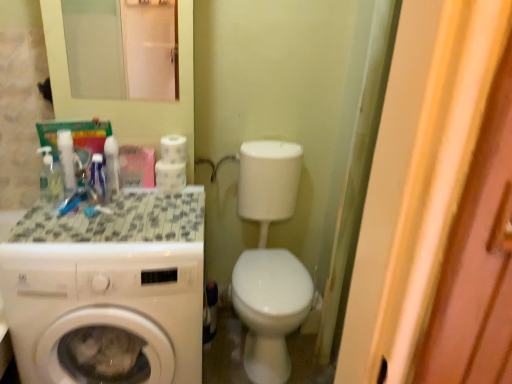
Question: Considering the relative sizes of white glossy washing machine at left and white glossy mouthwash at upper left, which is the third mouthwash from left to right, in the image provided, is white glossy washing machine at left taller than white glossy mouthwash at upper left, which is the third mouthwash from left to right,?

Choices:
 (A) no
 (B) yes

Answer: (B)

Question: Is white glossy washing machine at left directly adjacent to white glossy mouthwash at upper left, which is the third mouthwash from left to right?

Choices:
 (A) no
 (B) yes

Answer: (A)

Question: Does white glossy washing machine at left have a smaller size compared to white glossy mouthwash at upper left, which is the third mouthwash from left to right?

Choices:
 (A) no
 (B) yes

Answer: (A)

Question: Is white glossy washing machine at left not near white glossy mouthwash at upper left, which is the third mouthwash from left to right?

Choices:
 (A) no
 (B) yes

Answer: (A)

Question: From the image's perspective, does white glossy washing machine at left appear higher than white glossy mouthwash at upper left, placed as the 1th mouthwash when sorted from right to left?

Choices:
 (A) yes
 (B) no

Answer: (B)

Question: Is white glossy faucet at upper center wider or thinner than tile mosaic countertop at left?

Choices:
 (A) thin
 (B) wide

Answer: (A)

Question: From the image's perspective, is white glossy faucet at upper center positioned above or below tile mosaic countertop at left?

Choices:
 (A) above
 (B) below

Answer: (A)

Question: Is white glossy faucet at upper center taller or shorter than tile mosaic countertop at left?

Choices:
 (A) short
 (B) tall

Answer: (B)

Question: Based on their sizes in the image, would you say white glossy faucet at upper center is bigger or smaller than tile mosaic countertop at left?

Choices:
 (A) big
 (B) small

Answer: (A)

Question: From the image's perspective, is white glossy washing machine at left positioned above or below white glossy mouthwash at left, which is the second mouthwash in left-to-right order?

Choices:
 (A) below
 (B) above

Answer: (A)

Question: In the image, is white glossy washing machine at left positioned in front of or behind white glossy mouthwash at left, which is the second mouthwash in left-to-right order?

Choices:
 (A) behind
 (B) front

Answer: (B)

Question: Is white glossy washing machine at left situated inside white glossy mouthwash at left, which is the second mouthwash in left-to-right order, or outside?

Choices:
 (A) outside
 (B) inside

Answer: (A)

Question: Is white glossy washing machine at left bigger or smaller than white glossy mouthwash at left, placed as the 2th mouthwash when sorted from right to left?

Choices:
 (A) small
 (B) big

Answer: (B)

Question: Considering the positions of white glossy mouthwash at upper left, placed as the 1th mouthwash when sorted from right to left, and white matte toilet paper at upper center, which is counted as the first toilet paper, starting from the top, in the image, is white glossy mouthwash at upper left, placed as the 1th mouthwash when sorted from right to left, taller or shorter than white matte toilet paper at upper center, which is counted as the first toilet paper, starting from the top,?

Choices:
 (A) tall
 (B) short

Answer: (A)

Question: From a real-world perspective, relative to white matte toilet paper at upper center, which is the 2th toilet paper in bottom-to-top order, is white glossy mouthwash at upper left, placed as the 1th mouthwash when sorted from right to left, vertically above or below?

Choices:
 (A) below
 (B) above

Answer: (A)